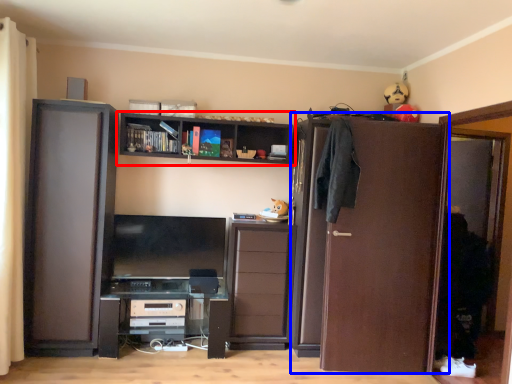
Question: Which of the following is the farthest to the observer, shelf (highlighted by a red box) or door (highlighted by a blue box)?

Choices:
 (A) shelf
 (B) door

Answer: (A)